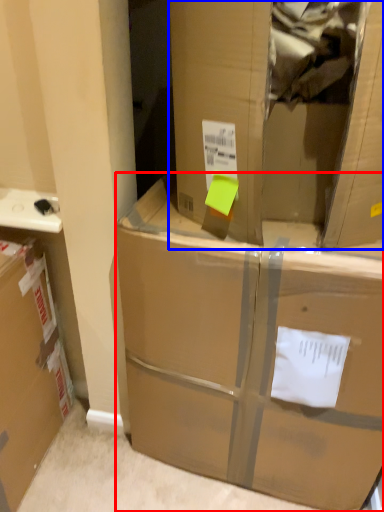
Question: Which of the following is the farthest to the observer, box (highlighted by a red box) or cardboard box (highlighted by a blue box)?

Choices:
 (A) box
 (B) cardboard box

Answer: (A)